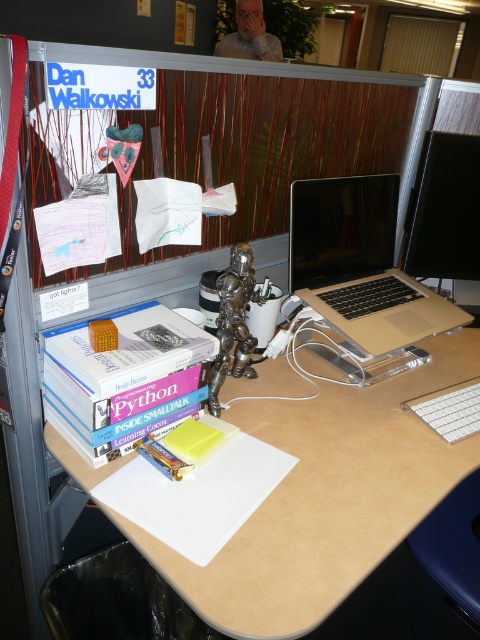
You need to place both the gold metallic laptop at upper right and the bronze metallic figurine at center into a rectangular box that can only accommodate items up to the size of the laptop. Will both items fit?

The gold metallic laptop at upper right is wider than the bronze metallic figurine at center. Since the box can only fit items up to the size of the laptop, both items will fit as the figurine is smaller than the laptop.

You are a new employee trying to set up your workstation. You need to place a mouse next to the white plastic keyboard at lower right. Where should you place it relative to the beige wood computer desk at center?

The beige wood computer desk at center is in front of the white plastic keyboard at lower right, so you should place the mouse next to the white plastic keyboard at lower right, which is behind the beige wood computer desk at center.

You are organizing your desk and need to place a new item that requires space equivalent to the gold metallic laptop at upper right. Can the bronze metallic figurine at center be moved to accommodate this item?

The gold metallic laptop at upper right is larger in size than the bronze metallic figurine at center. Therefore, moving the bronze metallic figurine at center might not provide enough space for the new item since it is smaller than the required space.